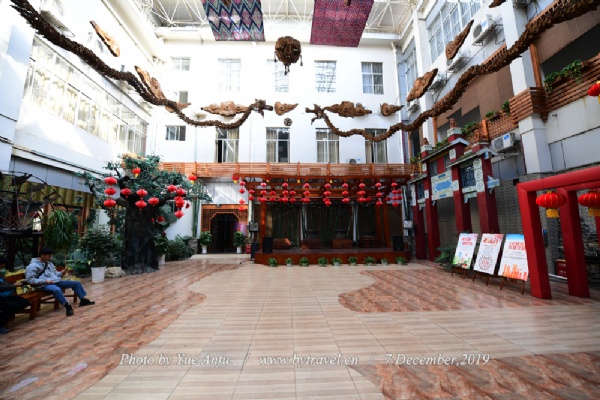
Where is `rugs`? Image resolution: width=600 pixels, height=400 pixels. rugs is located at coordinates (142, 308), (409, 282), (531, 383).